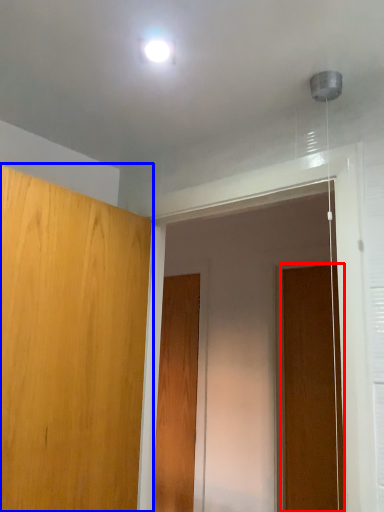
Question: Which object appears farthest to the camera in this image, door (highlighted by a red box) or door (highlighted by a blue box)?

Choices:
 (A) door
 (B) door

Answer: (A)